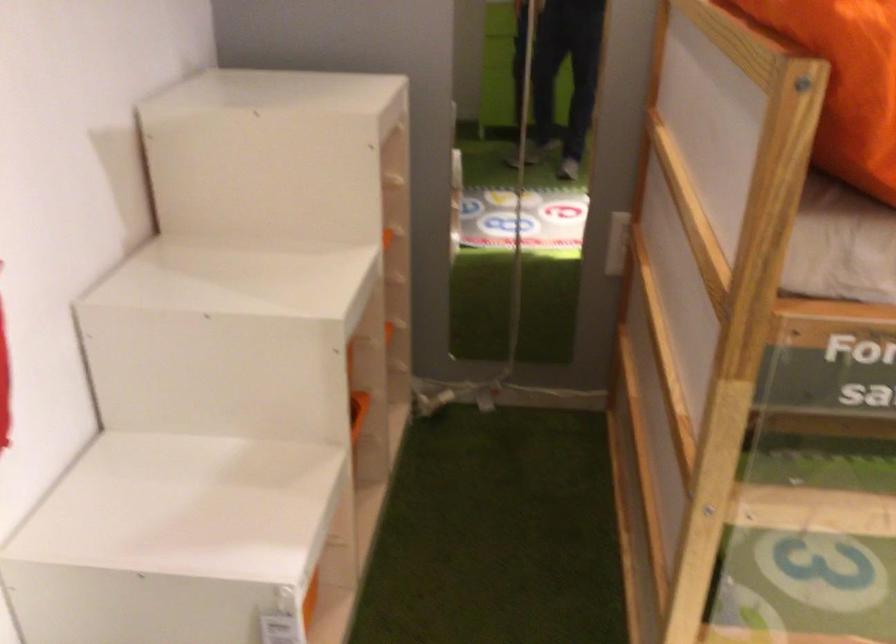
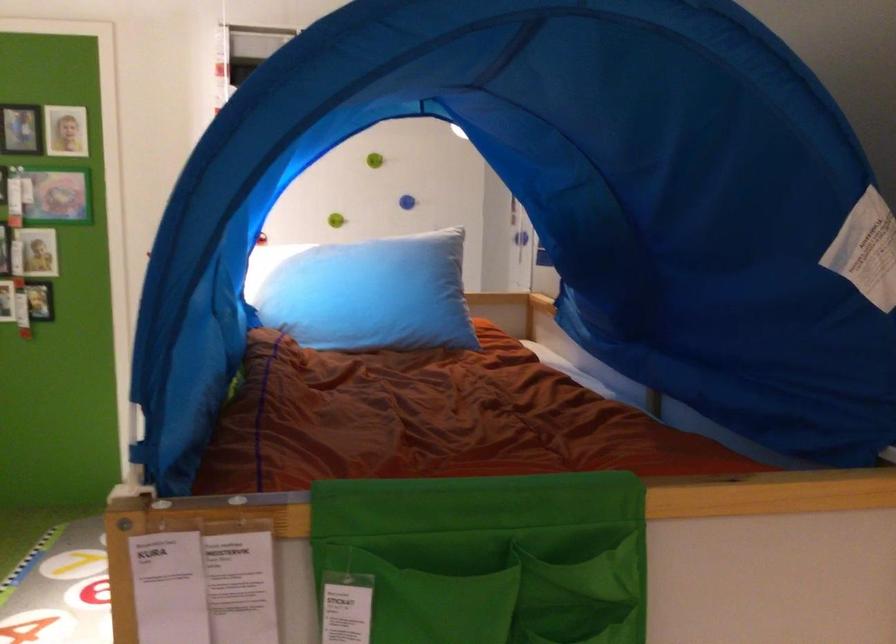
Question: I am providing you with two images of the same scene from different viewpoints. After the viewpoint changes to image2, which objects are now occluded?

Choices:
 (A) wooden ladder rung
 (B) blue wall knob
 (C) light blue pillow
 (D) brown bunny toy

Answer: (A)